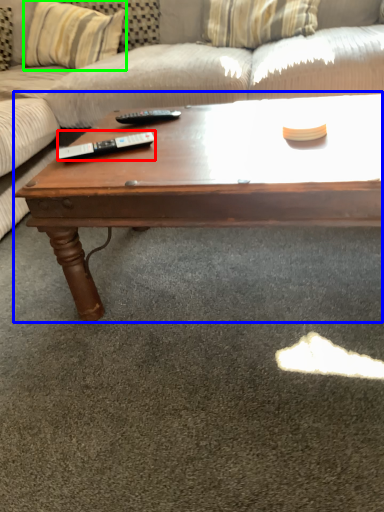
Question: Which is nearer to the remote (highlighted by a red box)? coffee table (highlighted by a blue box) or pillow (highlighted by a green box).

Choices:
 (A) coffee table
 (B) pillow

Answer: (A)